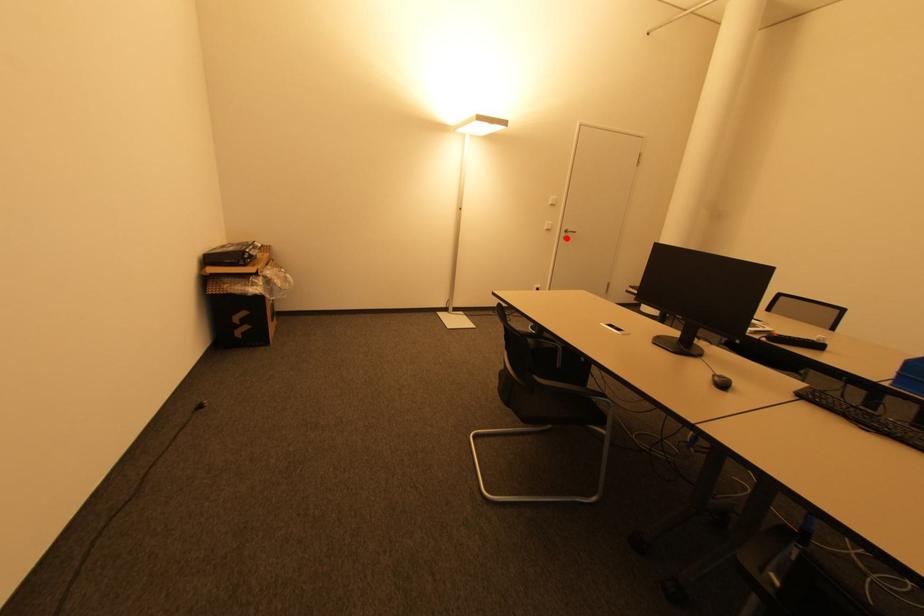
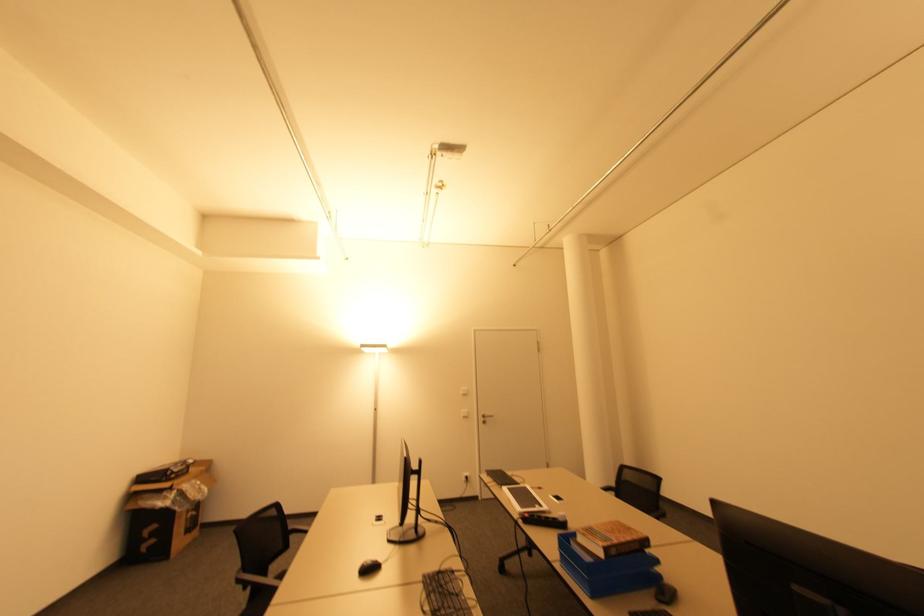
Locate, in the second image, the point that corresponds to the highlighted location in the first image.

(485, 422)